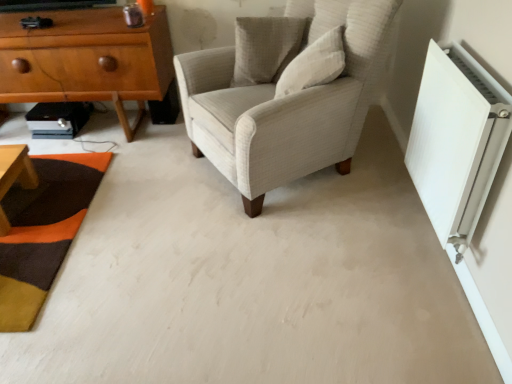
You are a GUI agent. You are given a task and a screenshot of the screen. Output one action in this format:
    pyautogui.click(x=<x>, y=<y>)
    Task: Click on the free spot in front of light beige fabric armchair at center
    
    Given the screenshot: What is the action you would take?
    pyautogui.click(x=286, y=260)